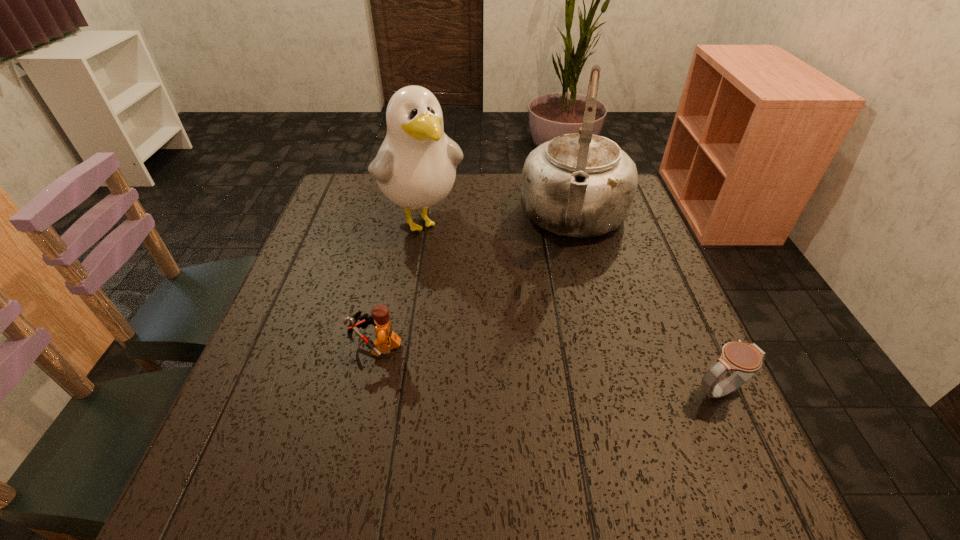
In order to click on free spot between the gull and the Lego in this screenshot , I will do `click(398, 283)`.

Where is `vacant area that lies between the watch and the gull`? vacant area that lies between the watch and the gull is located at coordinates (570, 305).

Find the location of a particular element. The height and width of the screenshot is (540, 960). unoccupied area between the second nearest object and the watch is located at coordinates (547, 368).

The width and height of the screenshot is (960, 540). What are the coordinates of `unoccupied area between the nearest object and the kettle` in the screenshot? It's located at (647, 305).

Locate an element on the screen. vacant point located between the gull and the kettle is located at coordinates (498, 219).

Where is `free space between the Lego and the gull`? The height and width of the screenshot is (540, 960). free space between the Lego and the gull is located at coordinates (398, 283).

Locate an element on the screen. This screenshot has width=960, height=540. free space between the third farthest object and the kettle is located at coordinates (475, 283).

Identify the location of free point between the Lego and the nearest object. (547, 368).

The width and height of the screenshot is (960, 540). In order to click on object that is the third closest to the kettle in this screenshot , I will do `click(387, 339)`.

Identify which object is the third closest to the kettle. Please provide its 2D coordinates. Your answer should be formatted as a tuple, i.e. [(x, y)], where the tuple contains the x and y coordinates of a point satisfying the conditions above.

[(387, 339)]